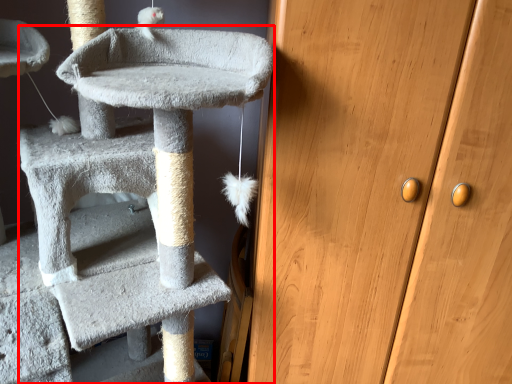
Question: In this image, where is cat furniture (annotated by the red box) located relative to door?

Choices:
 (A) left
 (B) right

Answer: (A)